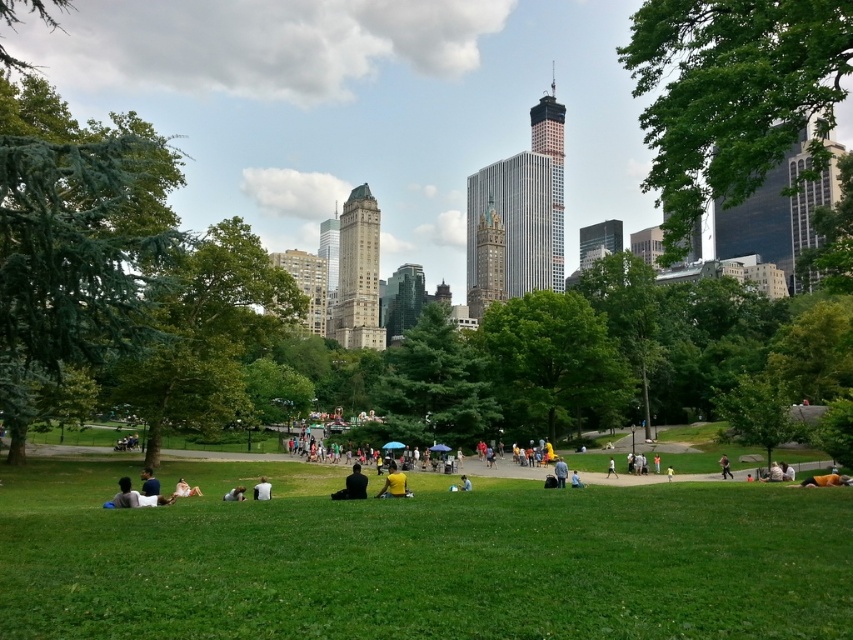
Which of these two, green grassy field at center or light blue shirt at lower center, stands taller?

Standing taller between the two is green grassy field at center.

Locate an element on the screen. The height and width of the screenshot is (640, 853). green grassy field at center is located at coordinates (419, 557).

Does light brown fabric at lower left have a smaller size compared to dark blue shirt at lower left?

Correct, light brown fabric at lower left occupies less space than dark blue shirt at lower left.

The height and width of the screenshot is (640, 853). What do you see at coordinates (136, 497) in the screenshot?
I see `light brown fabric at lower left` at bounding box center [136, 497].

You are a GUI agent. You are given a task and a screenshot of the screen. Output one action in this format:
    pyautogui.click(x=<x>, y=<y>)
    Task: Click on the light brown fabric at lower left
    This screenshot has height=640, width=853.
    Given the screenshot: What is the action you would take?
    pyautogui.click(x=136, y=497)

Between light brown fabric at lower left and light brown leather jacket at center, which one is positioned lower?

light brown leather jacket at center is lower down.

Between light brown fabric at lower left and light brown leather jacket at center, which one has more height?

With more height is light brown fabric at lower left.

Which is behind, point (160, 504) or point (608, 460)?

The point (608, 460) is more distant.

Where is `light brown fabric at lower left`? light brown fabric at lower left is located at coordinates (136, 497).